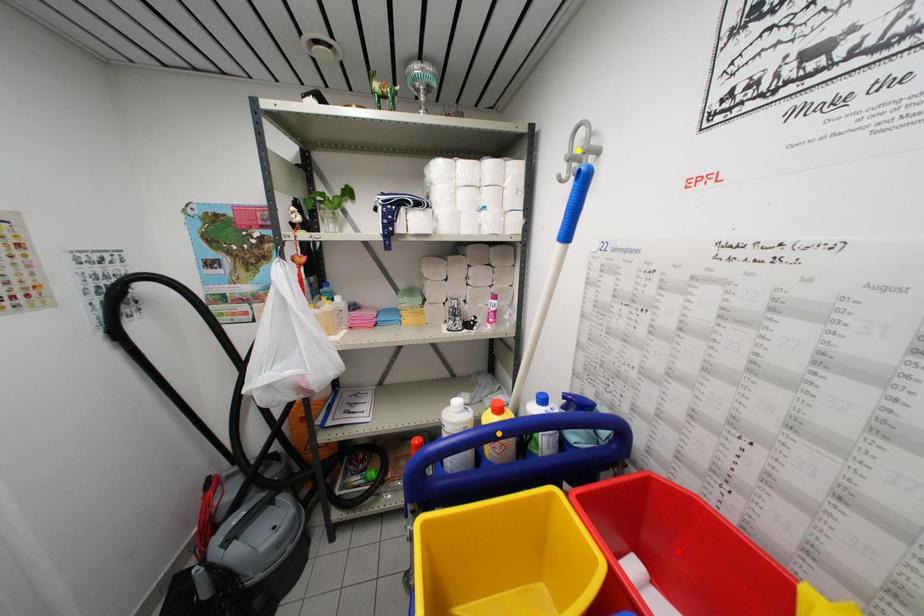
Order these from nearest to farthest:
red point, orange point, yellow point

red point < yellow point < orange point